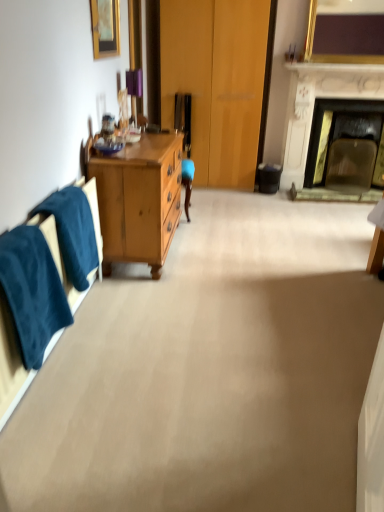
Question: From a real-world perspective, is gold-framed picture at upper left, which is counted as the 1th picture frame, starting from the front, positioned above or below gold metallic picture frame at upper right, which is counted as the second picture frame, starting from the bottom?

Choices:
 (A) above
 (B) below

Answer: (B)

Question: Considering the relative positions of gold-framed picture at upper left, the 1th picture frame from the left, and gold metallic picture frame at upper right, the second picture frame in the left-to-right sequence, in the image provided, is gold-framed picture at upper left, the 1th picture frame from the left, to the left or to the right of gold metallic picture frame at upper right, the second picture frame in the left-to-right sequence,?

Choices:
 (A) right
 (B) left

Answer: (B)

Question: Estimate the real-world distances between objects in this image. Which object is farther from the gold metallic picture frame at upper right, the 2th picture frame in the front-to-back sequence?

Choices:
 (A) white marble fireplace at upper right
 (B) black plastic trash can at lower right
 (C) blue fabric towel at left, the second towel/napkin positioned from the front
 (D) velvety blue towel at left, the 2th towel/napkin viewed from the back
 (E) gold-framed picture at upper left, the 1th picture frame from the left

Answer: (D)

Question: Considering the real-world distances, which object is closest to the velvety blue towel at left, the 2th towel/napkin viewed from the back?

Choices:
 (A) gold metallic picture frame at upper right, the 2th picture frame in the front-to-back sequence
 (B) blue fabric towel at left, the second towel/napkin positioned from the front
 (C) gold-framed picture at upper left, the first picture frame from the bottom
 (D) black plastic trash can at lower right
 (E) white marble fireplace at upper right

Answer: (B)